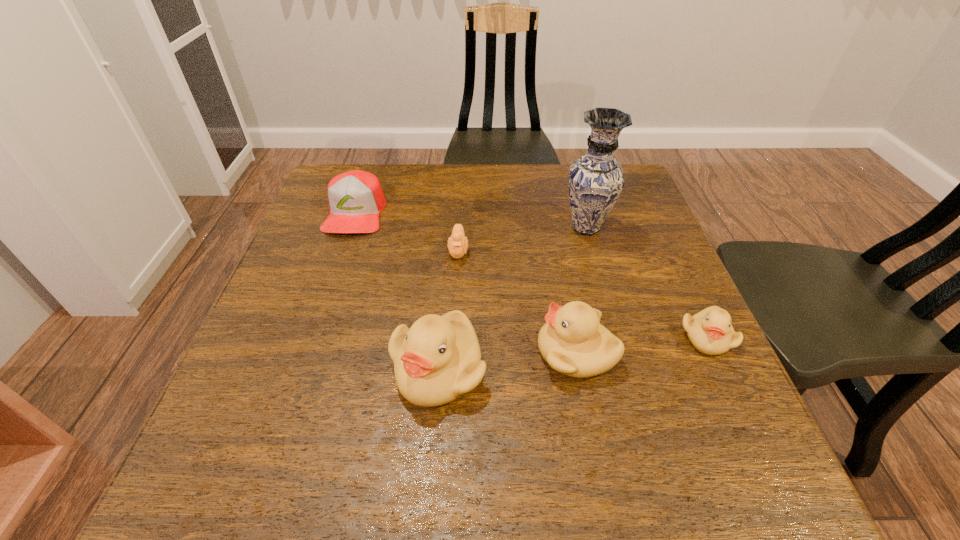
Locate an element on the screen. The height and width of the screenshot is (540, 960). vacant spot to place a duckling on the left is located at coordinates (290, 387).